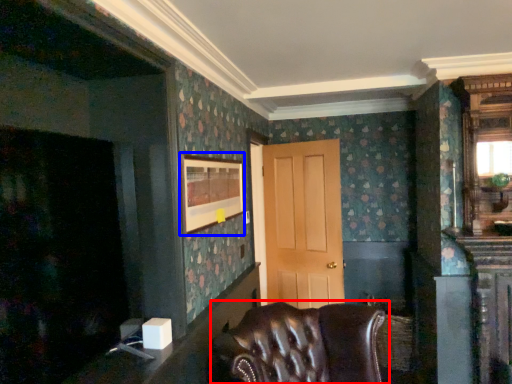
Question: Which object appears farthest to the camera in this image, chair (highlighted by a red box) or picture frame (highlighted by a blue box)?

Choices:
 (A) chair
 (B) picture frame

Answer: (B)